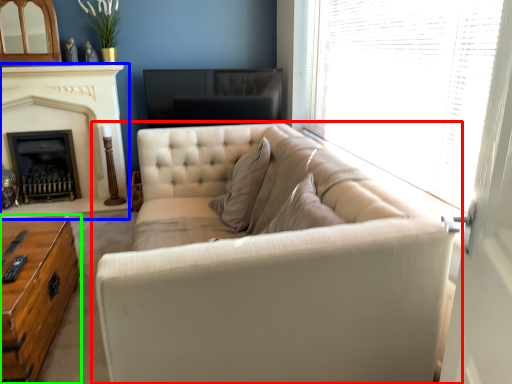
Question: Considering the real-world distances, which object is closest to studio couch (highlighted by a red box)? fireplace (highlighted by a blue box) or table (highlighted by a green box).

Choices:
 (A) fireplace
 (B) table

Answer: (B)